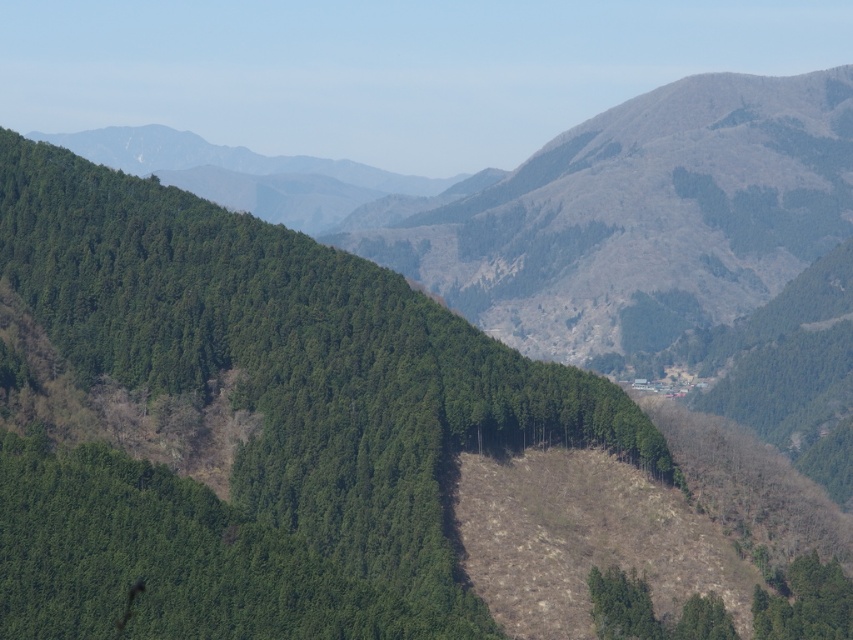
Question: From the image, what is the correct spatial relationship of green textured forest at center in relation to green matte tree at lower right?

Choices:
 (A) above
 (B) below

Answer: (A)

Question: Is green textured forest at center positioned before green matte tree at lower right?

Choices:
 (A) no
 (B) yes

Answer: (B)

Question: Which point is closer to the camera?

Choices:
 (A) (816, 563)
 (B) (13, 493)

Answer: (B)

Question: Which of the following is the closest to the observer?

Choices:
 (A) green matte tree at lower right
 (B) green textured forest at center

Answer: (B)

Question: From the image, what is the correct spatial relationship of green textured forest at center in relation to green matte tree at lower right?

Choices:
 (A) right
 (B) left

Answer: (B)